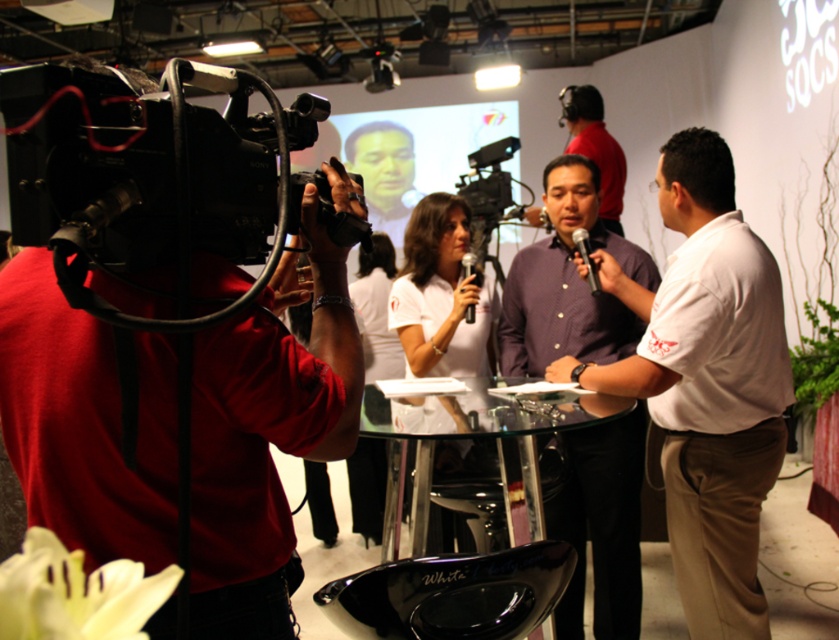
You are a photographer at the event and need to position yourself to capture the three people around the round glass table. The camera you have is located at point [264,436]. Can you estimate if the camera is positioned to the left or right of the table?

The matte black camera at left is represented by point [264,436], so the camera is positioned to the left of the table.

You are standing at the entrance of the event venue and want to locate the person wearing the white shirt at center. According to the coordinates provided, where should you look to find them?

The white shirt at center is located at coordinates point 0.600 on the x axis and 0.843 on the y axis.

You are a photographer at the event and need to capture a group photo of the white shirt at center and the purple cotton shirt at center. Which subject should you position closer to the camera to ensure both appear equally sized in the photo?

To ensure both the white shirt at center and the purple cotton shirt at center appear equally sized in the photo, position the purple cotton shirt at center closer to the camera since it is narrower than the white shirt at center.